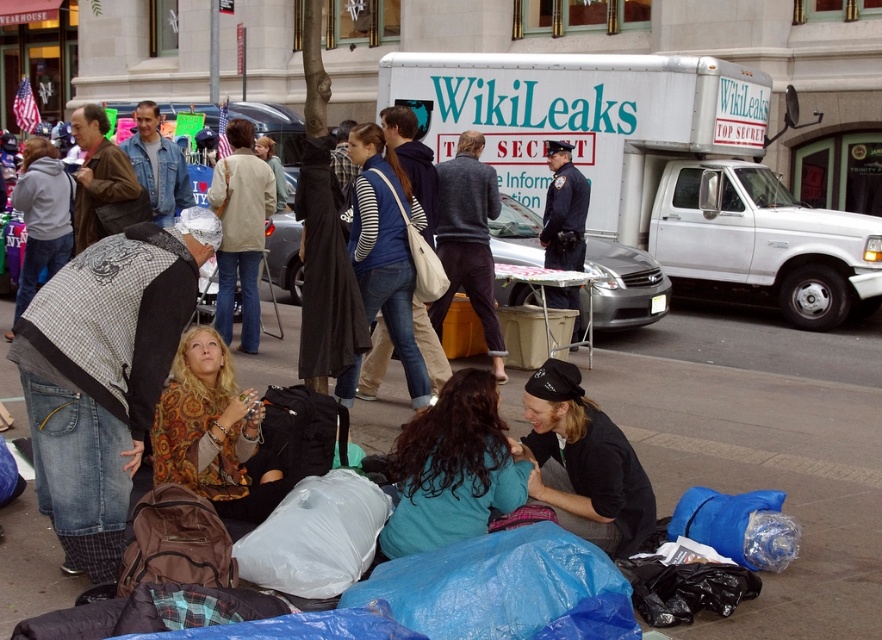
You are a photographer trying to capture a candid shot of the scene. You want to focus on the dark brown leather jacket at lower center and the dark blue uniform at center. Which object is closer to the camera based on their positions?

The dark brown leather jacket at lower center is positioned under the dark blue uniform at center, meaning it is closer to the camera.

In the scene shown: You are a photographer trying to capture a candid shot of the scene. You have a camera and need to place it on the ground near the dark brown leather jacket at lower center. However, you only have 15 feet of space between you and the jacket. Is there enough space to place your camera without moving the jacket?

The distance between the dark brown leather jacket at lower center and the camera is 14.58 feet, which is within the 15 feet space you have. Therefore, you can place the camera near the jacket without moving it.

You are a delivery person trying to place a package on the blue tarp at lower center. However, there is a dark brown leather jacket at lower center in the way. Can you place the package there without moving the jacket?

The blue tarp at lower center is above the dark brown leather jacket at lower center, so the package can be placed on the tarp without disturbing the jacket.